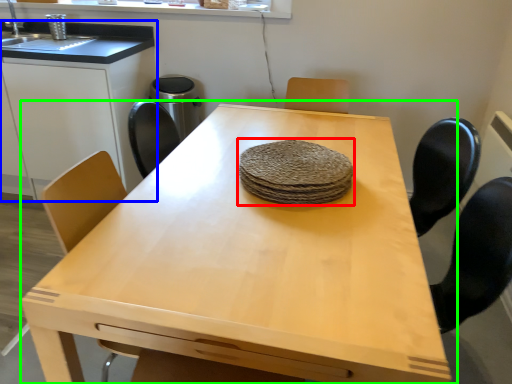
Question: Based on their relative distances, which object is farther from food (highlighted by a red box)? Choose from cabinetry (highlighted by a blue box) and table (highlighted by a green box).

Choices:
 (A) cabinetry
 (B) table

Answer: (A)